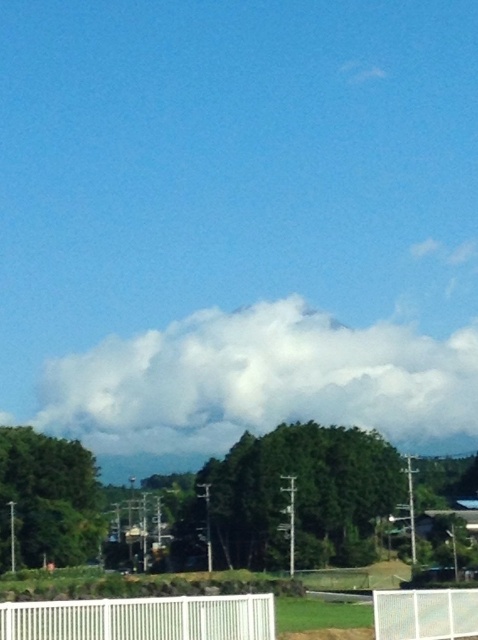
Does white plastic fence at lower center appear on the left side of white mesh fence at lower center?

Indeed, white plastic fence at lower center is positioned on the left side of white mesh fence at lower center.

I want to click on white plastic fence at lower center, so click(x=141, y=618).

This screenshot has width=478, height=640. I want to click on white plastic fence at lower center, so click(141, 618).